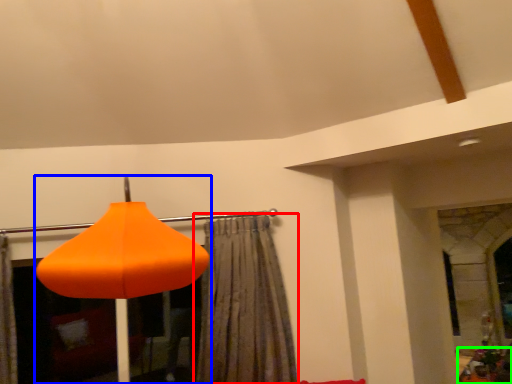
Question: Which object is positioned farthest from curtain (highlighted by a red box)? Select from lamp (highlighted by a blue box) and furniture (highlighted by a green box).

Choices:
 (A) lamp
 (B) furniture

Answer: (B)